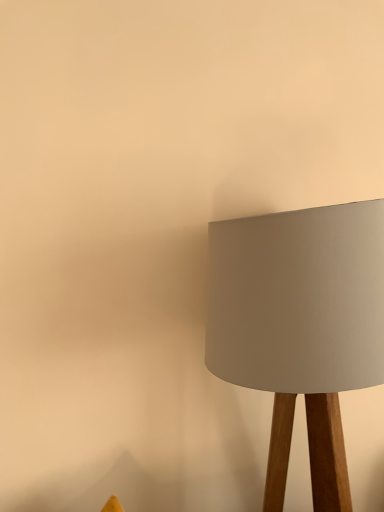
In order to face matte gray lampshade at upper right, should I rotate leftwards or rightwards?

To face it directly, rotate right by 16.188 degrees.

Describe the element at coordinates (300, 326) in the screenshot. This screenshot has height=512, width=384. I see `matte gray lampshade at upper right` at that location.

Identify the location of matte gray lampshade at upper right. This screenshot has height=512, width=384. (300, 326).

I want to click on matte gray lampshade at upper right, so click(x=300, y=326).